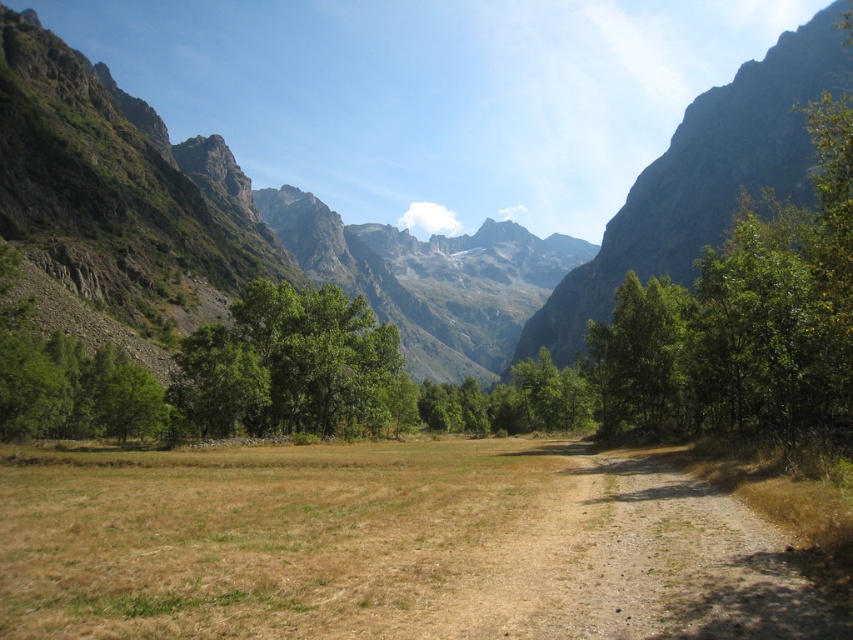
You are planning a hiking trip and want to know which mountain is taller between the rocky gray mountain at center and the rugged rock mountain at upper right. Based on the scene, which one should you consider taller?

The rocky gray mountain at center is taller than the rugged rock mountain at upper right according to the description.

You are standing on the dirt path in the grassy field and want to hike towards the mountains. Which mountain, the rocky gray mountain at center or the rugged rock mountain at upper right, would you reach first if you follow the path?

You would reach the rocky gray mountain at center first because it is closer to the viewer than the rugged rock mountain at upper right.